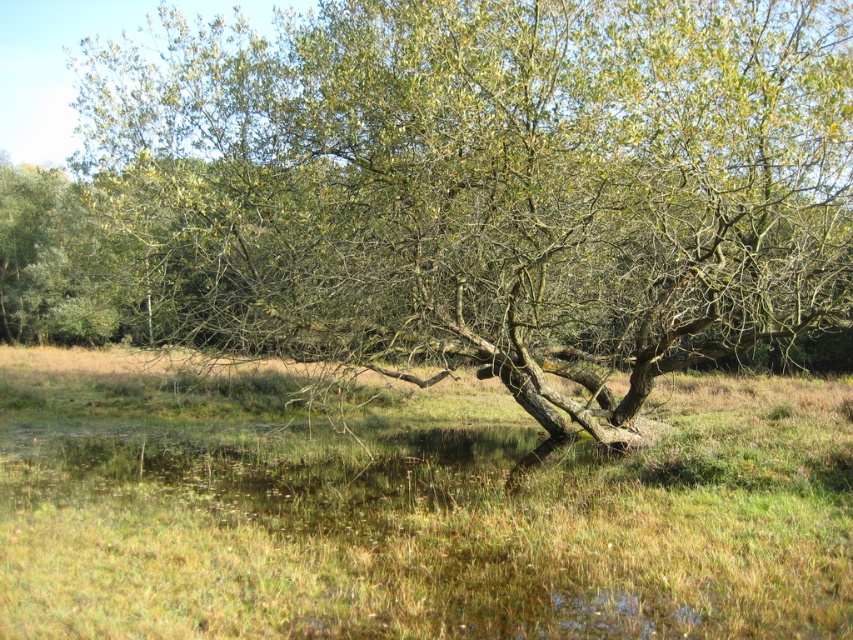
You are standing at the center of the image and want to walk towards the green leafy tree at center. In which direction should you move?

Since the green leafy tree at center is already at the center of the image, you are already facing the tree and do not need to move in any direction to reach it.

You are standing at the edge of a forest path and see the green leafy tree at center in the distance. If you want to reach the tree within 10 seconds, what is the minimum speed you need to walk at?

The green leafy tree at center is 8.43 meters away. To cover this distance in 10 seconds, you need to walk at a minimum speed of 0.843 meters per second.

You are a gardener planning to plant a new tree in the center of your garden. You have a green leafy tree at center and green grass at center. Which one takes up more space horizontally?

The green grass at center has a greater width than the green leafy tree at center, so the grass takes up more horizontal space.